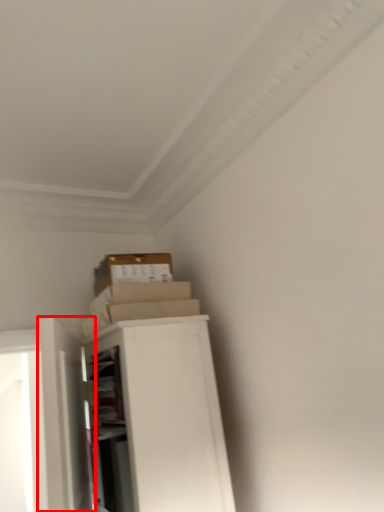
Question: In this image, where is door (annotated by the red box) located relative to file cabinet?

Choices:
 (A) left
 (B) right

Answer: (A)